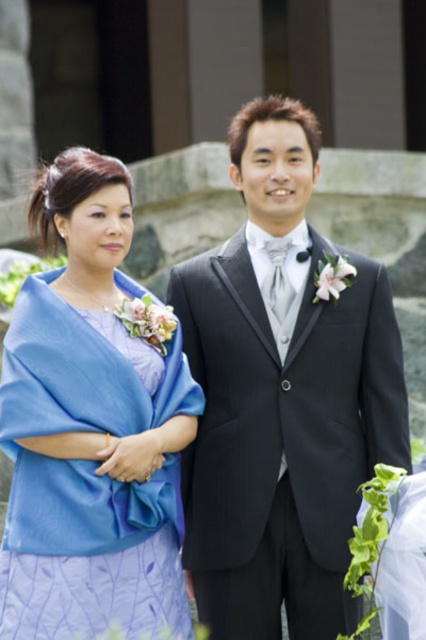
Which is more to the left, shiny black suit at center or lavender satin dress at left?

lavender satin dress at left is more to the left.

Which is in front, point (287, 268) or point (51, 332)?

Point (51, 332)

Find the location of a particular element. This screenshot has height=640, width=426. shiny black suit at center is located at coordinates (282, 397).